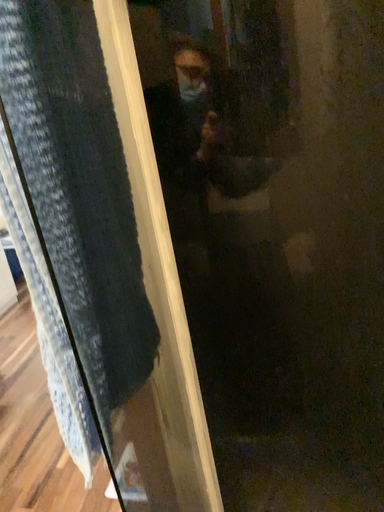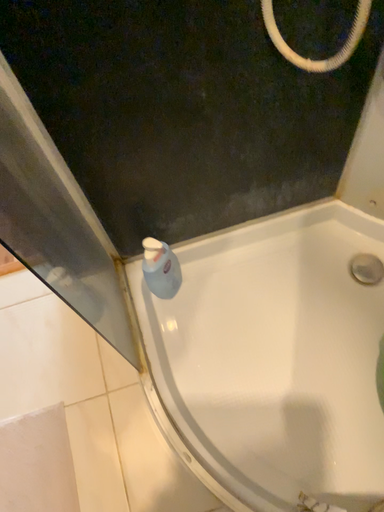
Question: How did the camera likely rotate when shooting the video?

Choices:
 (A) rotated downward
 (B) rotated upward

Answer: (A)